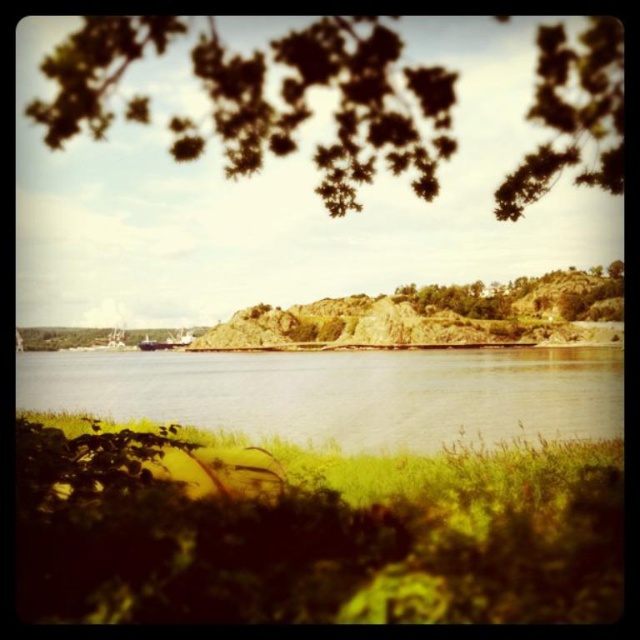
Question: Is the position of dark green leaves at upper center less distant than that of green rough textured rock at center?

Choices:
 (A) no
 (B) yes

Answer: (B)

Question: Which object is the farthest from the metallic gray boat at center?

Choices:
 (A) green rough textured rock at center
 (B) green grass at lower center

Answer: (B)

Question: Is green grass at lower center to the left of metallic gray boat at center from the viewer's perspective?

Choices:
 (A) no
 (B) yes

Answer: (A)

Question: Which of the following is the closest to the observer?

Choices:
 (A) green grass at lower center
 (B) metallic gray boat at center
 (C) green rough textured rock at center

Answer: (A)

Question: Can you confirm if dark green leaves at upper center is wider than green grass at lower center?

Choices:
 (A) no
 (B) yes

Answer: (B)

Question: Which point is closer to the camera?

Choices:
 (A) (412, 120)
 (B) (164, 340)

Answer: (A)